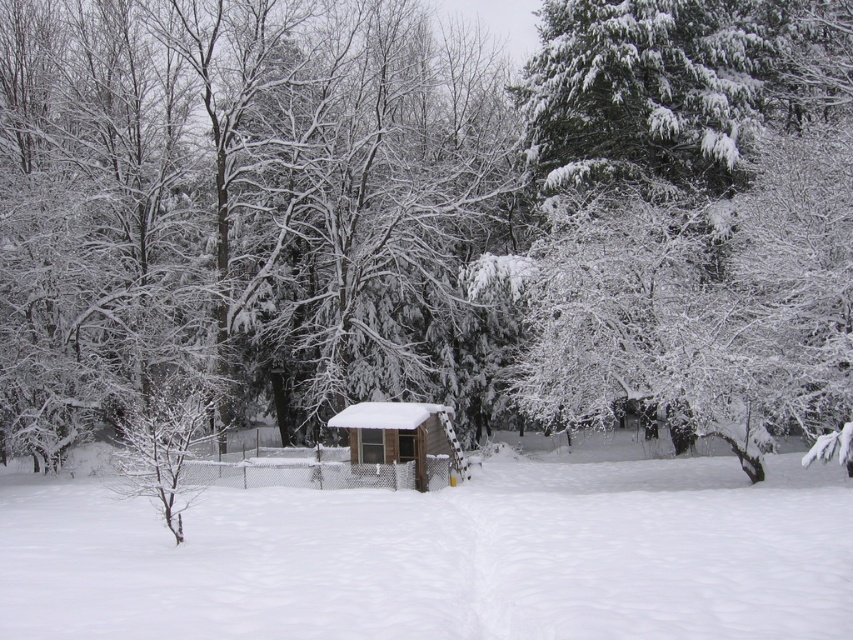
Can you confirm if snow-covered evergreen at upper right is positioned above wooden cabin at center?

Indeed, snow-covered evergreen at upper right is positioned over wooden cabin at center.

Looking at this image, can you confirm if snow-covered evergreen at upper right is taller than wooden cabin at center?

Correct, snow-covered evergreen at upper right is much taller as wooden cabin at center.

Does point (801, 301) come closer to viewer compared to point (426, 442)?

Yes, point (801, 301) is closer to viewer.

Locate an element on the screen. snow-covered evergreen at upper right is located at coordinates (695, 218).

Does snow-covered evergreen tree at center have a larger size compared to white fluffy snow at center?

Yes.

From the picture: Does snow-covered evergreen tree at center come in front of white fluffy snow at center?

No, it is not.

Does point (86, 49) lie behind point (189, 570)?

Yes, point (86, 49) is farther from viewer.

The height and width of the screenshot is (640, 853). In order to click on snow-covered evergreen tree at center in this screenshot , I will do `click(236, 204)`.

Does snow-covered evergreen tree at center have a greater width compared to wooden cabin at center?

Yes, snow-covered evergreen tree at center is wider than wooden cabin at center.

How distant is snow-covered evergreen tree at center from wooden cabin at center?

snow-covered evergreen tree at center and wooden cabin at center are 16.68 meters apart from each other.

You are a GUI agent. You are given a task and a screenshot of the screen. Output one action in this format:
    pyautogui.click(x=<x>, y=<y>)
    Task: Click on the snow-covered evergreen tree at center
    The height and width of the screenshot is (640, 853).
    Given the screenshot: What is the action you would take?
    pyautogui.click(x=236, y=204)

Locate an element on the screen. This screenshot has width=853, height=640. snow-covered evergreen tree at center is located at coordinates click(x=236, y=204).